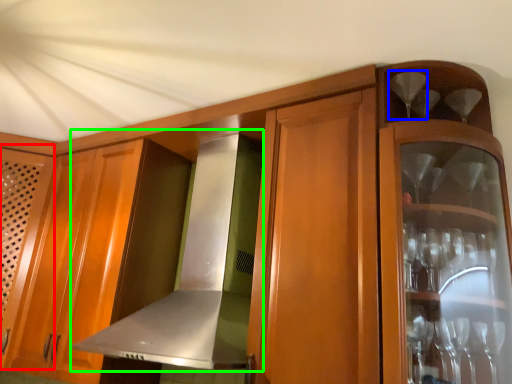
Question: Which object is positioned farthest from door (highlighted by a red box)? Select from wine glass (highlighted by a blue box) and exhaust hood (highlighted by a green box).

Choices:
 (A) wine glass
 (B) exhaust hood

Answer: (A)